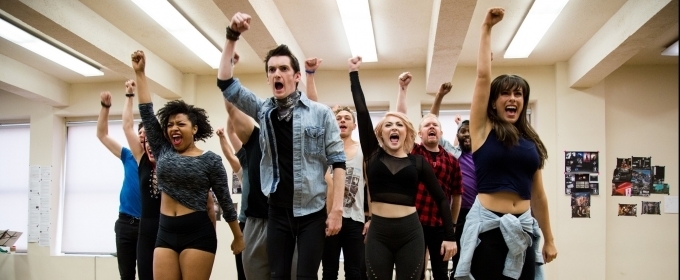
The width and height of the screenshot is (680, 280). I want to click on lights, so click(x=526, y=28), click(x=368, y=43), click(x=188, y=36), click(x=66, y=68).